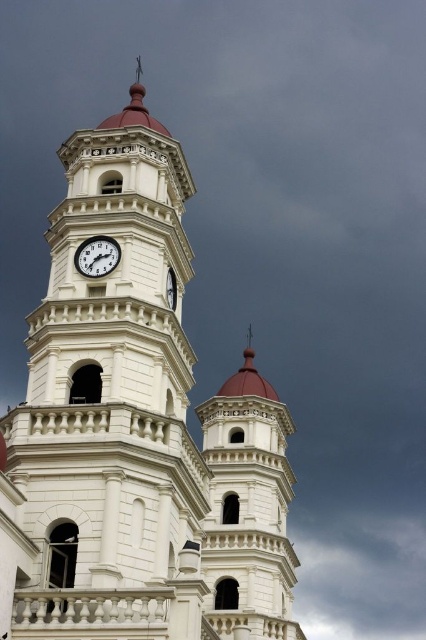
Which is above, white glossy clock at center or white glossy clock at upper center?

white glossy clock at center

Who is more distant from viewer, (104,269) or (175,298)?

Point (175,298)

Locate an element on the screen. This screenshot has height=640, width=426. white glossy clock at center is located at coordinates click(x=97, y=257).

In the scene shown: Does white stone clock tower at center appear on the left side of cloudy sky at upper center?

Indeed, white stone clock tower at center is positioned on the left side of cloudy sky at upper center.

Is the position of white stone clock tower at center more distant than that of cloudy sky at upper center?

No, it is not.

Describe the element at coordinates (137, 429) in the screenshot. Image resolution: width=426 pixels, height=640 pixels. I see `white stone clock tower at center` at that location.

Where is `white stone clock tower at center`? This screenshot has width=426, height=640. white stone clock tower at center is located at coordinates pyautogui.click(x=137, y=429).

Does white stone clock tower at center lie behind white glossy clock at upper center?

No, white stone clock tower at center is closer to the viewer.

Is white stone clock tower at center to the right of white glossy clock at upper center from the viewer's perspective?

Incorrect, white stone clock tower at center is not on the right side of white glossy clock at upper center.

Which is in front, point (127, 564) or point (172, 300)?

Point (127, 564) is in front.

This screenshot has width=426, height=640. What are the coordinates of `white stone clock tower at center` in the screenshot? It's located at (137, 429).